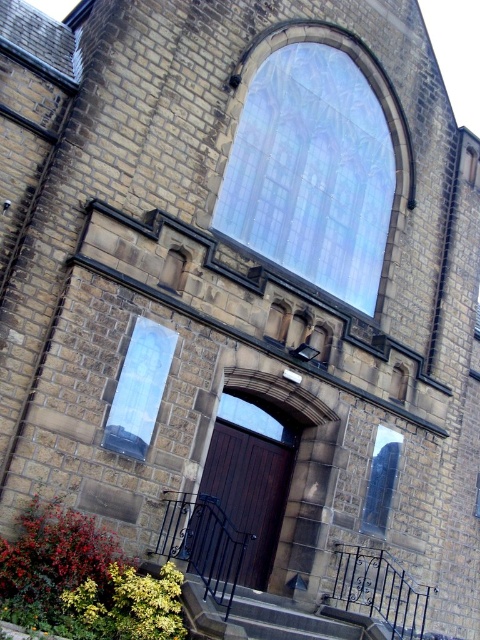
You are a visitor approaching the entrance of the stone building. You notice the dark wood door at center and the clear glass window at center. Which object is located above the other?

The clear glass window at center is above the dark wood door at center because the dark wood door at center is positioned under the clear glass window at center.

You are a maintenance worker needing to inspect both the black wrought iron stairs at lower center and the transparent glass window at center. Given that your ladder is 12 meters long, can you safely reach both objects from one position without moving the ladder?

The distance between the black wrought iron stairs at lower center and the transparent glass window at center is 13.51 meters. Since your ladder is only 12 meters long, it is not long enough to span the gap between them. Therefore, you would need to move the ladder to inspect both objects separately.